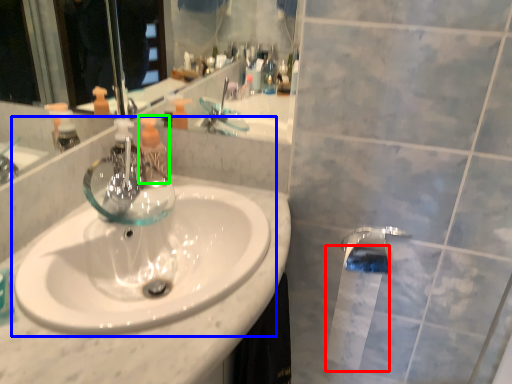
Question: Which object is positioned closest to toilet paper (highlighted by a red box)? Select from sink (highlighted by a blue box) and toiletry (highlighted by a green box).

Choices:
 (A) sink
 (B) toiletry

Answer: (A)